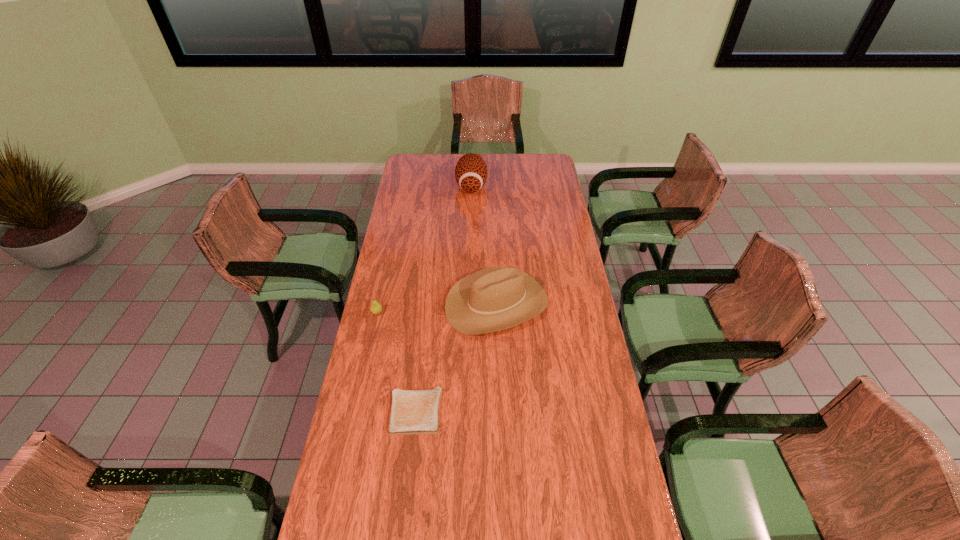
I want to click on the second closest object relative to the third tallest object, so click(412, 411).

At what (x,y) coordinates should I click in order to perform the action: click on free location that satisfies the following two spatial constraints: 1. on the back side of the cowboy hat; 2. on the left side of the shortest object. Please return your answer as a coordinate pair (x, y). Looking at the image, I should click on tap(427, 304).